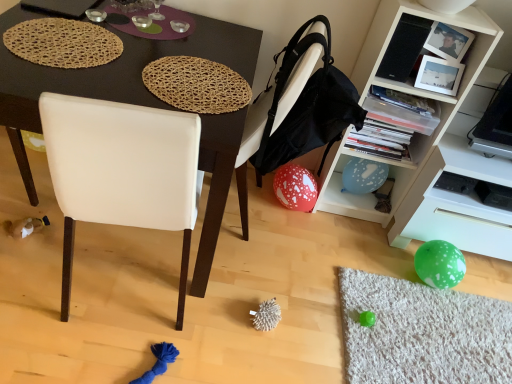
In order to click on vacant area that lies between white leather chair at center and matte black desk at center in this screenshot , I will do pos(231,266).